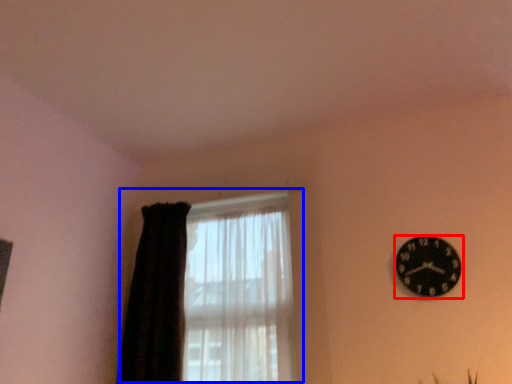
Question: Among these objects, which one is farthest to the camera, wall clock (highlighted by a red box) or window (highlighted by a blue box)?

Choices:
 (A) wall clock
 (B) window

Answer: (B)